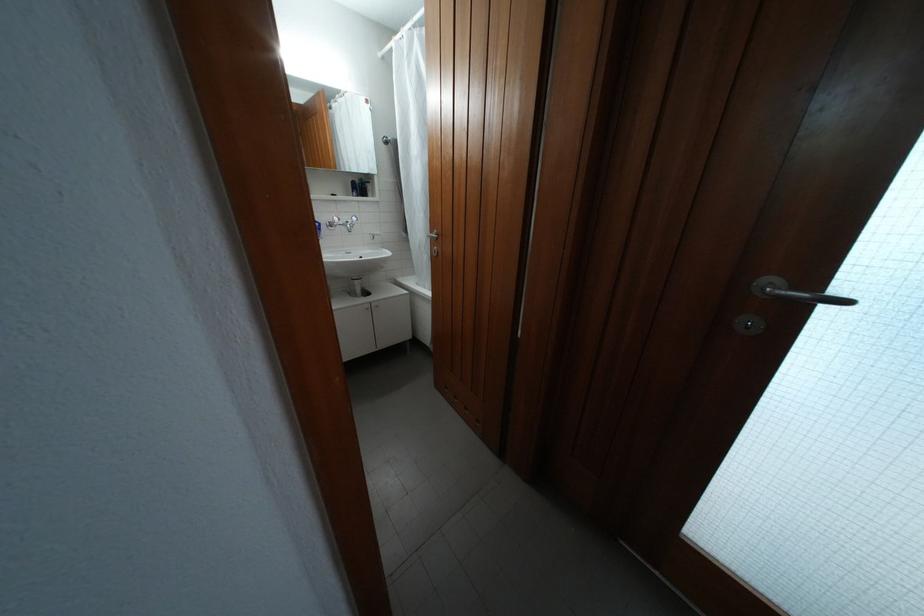
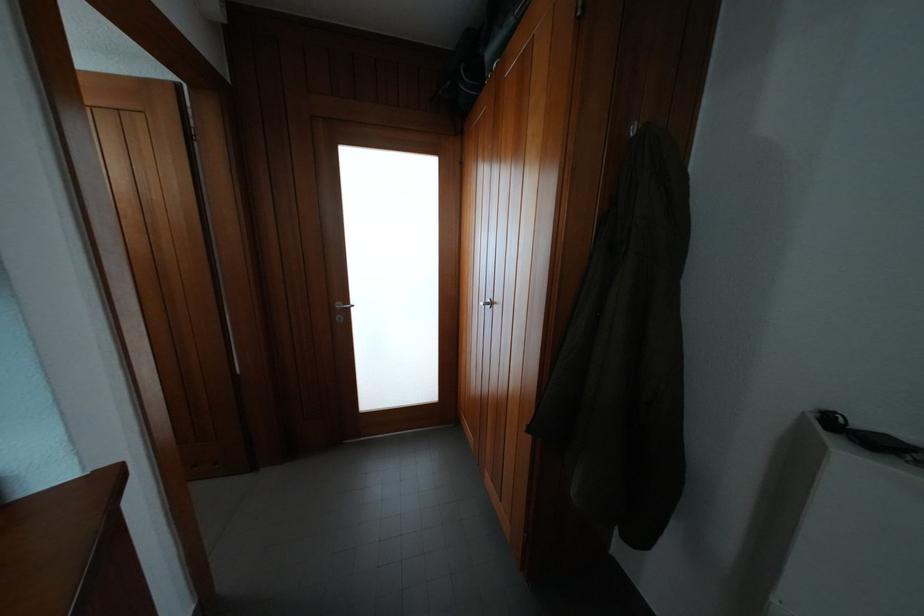
Question: The first image is from the beginning of the video and the second image is from the end. How did the camera likely rotate when shooting the video?

Choices:
 (A) Left
 (B) Right
 (C) Up
 (D) Down

Answer: (B)